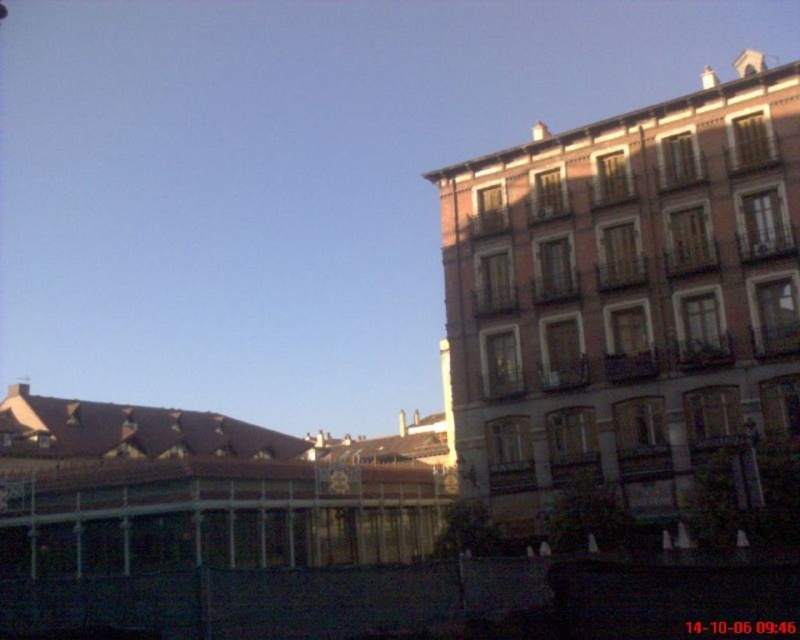
Can you confirm if red brick building at right is positioned below metallic gold clock at center?

No, red brick building at right is not below metallic gold clock at center.

Is red brick building at right positioned behind metallic gold clock at center?

No, red brick building at right is in front of metallic gold clock at center.

Is point (594, 420) closer to viewer compared to point (329, 474)?

That is True.

This screenshot has width=800, height=640. I want to click on red brick building at right, so click(x=624, y=298).

Does red brick building at right have a greater width compared to metallic gold clock at center-right?

Correct, the width of red brick building at right exceeds that of metallic gold clock at center-right.

Is red brick building at right positioned before metallic gold clock at center-right?

Yes, it is.

Is point (550, 349) positioned behind point (456, 483)?

That is False.

Where is `red brick building at right`? red brick building at right is located at coordinates (624, 298).

In the scene shown: Is metallic gold clock at center taller than metallic gold clock at center-right?

No, metallic gold clock at center is not taller than metallic gold clock at center-right.

Is metallic gold clock at center positioned at the back of metallic gold clock at center-right?

No, it is not.

The image size is (800, 640). What do you see at coordinates (338, 481) in the screenshot?
I see `metallic gold clock at center` at bounding box center [338, 481].

Image resolution: width=800 pixels, height=640 pixels. Identify the location of metallic gold clock at center. (338, 481).